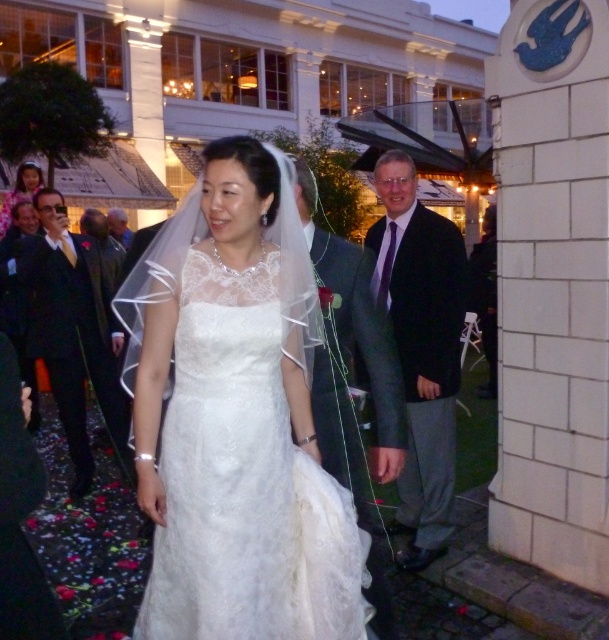
You are a photographer standing at the back of the aisle. You need to capture a photo of the gray wool suit at center. The camera you need is 2.20 meters away from it. Can you reach the camera in time if you start walking towards it at a speed of 1 meter per second?

The distance between the gray wool suit at center and the camera is 2.20 meters. Since you are moving at 1 meter per second, it would take approximately 2.2 seconds to reach the camera. However, the question mentions you are a photographer needing to capture a photo of the gray wool suit at center, which is 2.20 meters away from the camera. This implies the camera is positioned near you, and the suit is 2.2 meters away from the camera. Thus, you can adjust your focus to capture the suit from that distance,

You are a photographer at the wedding. You notice the gray wool suit at center and the matte white dress at upper left in your viewfinder. Which object is positioned lower in the frame?

The gray wool suit at center is below the matte white dress at upper left, so the gray wool suit at center is positioned lower in the frame.